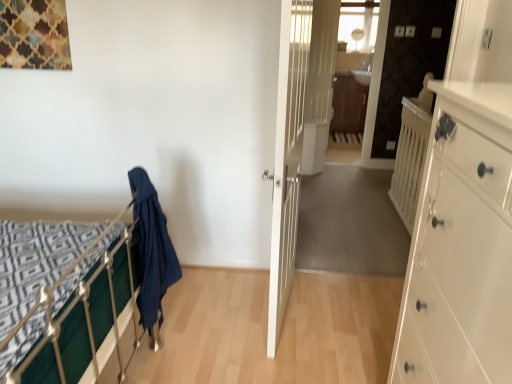
Question: Are brown wood/file cabinet at center and white wooden door at center, the 2th door viewed from the right, making contact?

Choices:
 (A) yes
 (B) no

Answer: (B)

Question: Considering the relative positions of brown wood/file cabinet at center and white wooden door at center, the 2th door viewed from the right, in the image provided, is brown wood/file cabinet at center to the right of white wooden door at center, the 2th door viewed from the right, from the viewer's perspective?

Choices:
 (A) no
 (B) yes

Answer: (B)

Question: Is the depth of brown wood/file cabinet at center greater than that of white wooden door at center, which is the second door in back-to-front order?

Choices:
 (A) yes
 (B) no

Answer: (A)

Question: Is brown wood/file cabinet at center taller than white wooden door at center, positioned as the 1th door in front-to-back order?

Choices:
 (A) yes
 (B) no

Answer: (B)

Question: Can you confirm if brown wood/file cabinet at center is shorter than white wooden door at center, which appears as the 1th door when viewed from the left?

Choices:
 (A) yes
 (B) no

Answer: (A)

Question: Is brown wood/file cabinet at center bigger or smaller than white wooden balustrade at right?

Choices:
 (A) big
 (B) small

Answer: (A)

Question: Relative to white wooden balustrade at right, is brown wood/file cabinet at center in front or behind?

Choices:
 (A) behind
 (B) front

Answer: (A)

Question: Does point (344, 99) appear closer or farther from the camera than point (406, 102)?

Choices:
 (A) closer
 (B) farther

Answer: (B)

Question: In terms of width, does brown wood/file cabinet at center look wider or thinner when compared to white wooden balustrade at right?

Choices:
 (A) wide
 (B) thin

Answer: (A)

Question: Considering their positions, is dark blue fabric at left located in front of or behind brown wood/file cabinet at center?

Choices:
 (A) behind
 (B) front

Answer: (B)

Question: In terms of size, does dark blue fabric at left appear bigger or smaller than brown wood/file cabinet at center?

Choices:
 (A) small
 (B) big

Answer: (A)

Question: Is dark blue fabric at left taller or shorter than brown wood/file cabinet at center?

Choices:
 (A) tall
 (B) short

Answer: (B)

Question: Is dark blue fabric at left inside the boundaries of brown wood/file cabinet at center, or outside?

Choices:
 (A) outside
 (B) inside

Answer: (A)

Question: Considering their positions, is white glossy chest of drawers at right located in front of or behind white glossy door at center, which appears as the 2th door when viewed from the left?

Choices:
 (A) front
 (B) behind

Answer: (A)

Question: In terms of height, does white glossy chest of drawers at right look taller or shorter compared to white glossy door at center, which appears as the 2th door when viewed from the left?

Choices:
 (A) short
 (B) tall

Answer: (A)